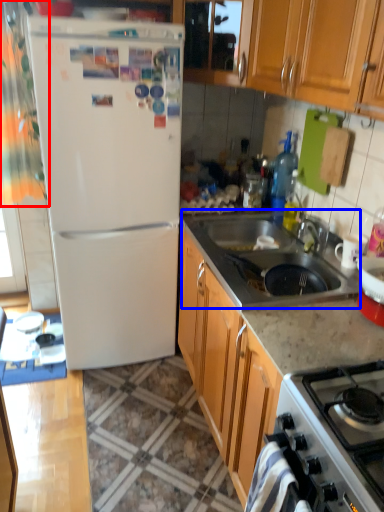
Question: Which object appears closest to the camera in this image, curtain (highlighted by a red box) or sink (highlighted by a blue box)?

Choices:
 (A) curtain
 (B) sink

Answer: (B)